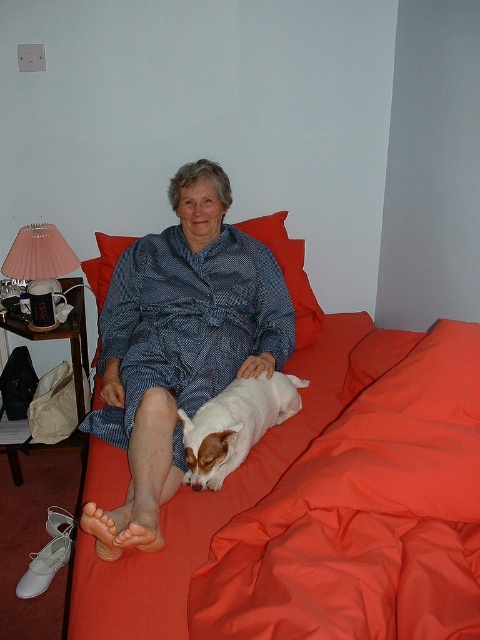
Is the position of matte orange bed at center more distant than that of red soft pillow at upper center?

No, it is not.

Between matte orange bed at center and red soft pillow at upper center, which one is positioned lower?

matte orange bed at center

This screenshot has width=480, height=640. What do you see at coordinates (324, 509) in the screenshot?
I see `matte orange bed at center` at bounding box center [324, 509].

You are a GUI agent. You are given a task and a screenshot of the screen. Output one action in this format:
    pyautogui.click(x=<x>, y=<y>)
    Task: Click on the matte orange bed at center
    
    Given the screenshot: What is the action you would take?
    pyautogui.click(x=324, y=509)

Is point (179, 228) farther from viewer compared to point (108, 252)?

No, (179, 228) is in front of (108, 252).

Does blue printed fabric at center lie in front of red soft pillow at upper center?

Yes, blue printed fabric at center is closer to the viewer.

Does point (210, 348) lie behind point (301, 272)?

No.

Identify the location of blue printed fabric at center. (179, 344).

Does matte orange bed at center have a lesser height compared to white fur dog at center?

No.

Between point (433, 356) and point (231, 401), which one is positioned in front?

Positioned in front is point (433, 356).

The width and height of the screenshot is (480, 640). In order to click on matte orange bed at center in this screenshot , I will do `click(324, 509)`.